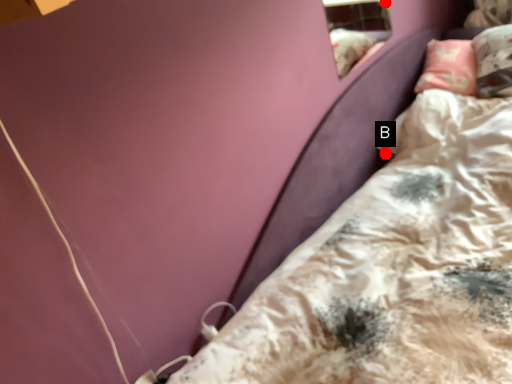
Question: Two points are circled on the image, labeled by A and B beside each circle. Which of the following is the farthest from the observer?

Choices:
 (A) A is further
 (B) B is further

Answer: (A)